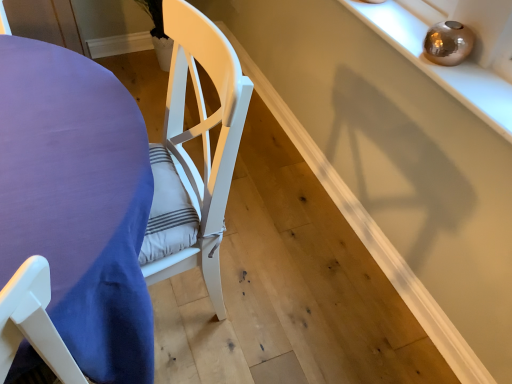
Where is `shiny metallic orb at upper right`? shiny metallic orb at upper right is located at coordinates (441, 66).

Describe the element at coordinates (441, 66) in the screenshot. I see `shiny metallic orb at upper right` at that location.

Measure the distance between point [344,1] and camera.

The distance of point [344,1] from camera is 4.51 feet.

Image resolution: width=512 pixels, height=384 pixels. What do you see at coordinates (78, 202) in the screenshot?
I see `purple fabric table at left` at bounding box center [78, 202].

What are the coordinates of `purple fabric table at left` in the screenshot? It's located at (78, 202).

Measure the distance between point (115, 367) and camera.

They are 39.13 inches apart.

Identify the location of shiny metallic orb at upper right. This screenshot has height=384, width=512. coord(441,66).

Considering the positions of objects purple fabric table at left and shiny metallic orb at upper right in the image provided, who is more to the left, purple fabric table at left or shiny metallic orb at upper right?

purple fabric table at left is more to the left.

Who is more distant, purple fabric table at left or shiny metallic orb at upper right?

shiny metallic orb at upper right is more distant.

Does point (38, 226) come closer to viewer compared to point (399, 41)?

Yes, point (38, 226) is closer to viewer.

From the image's perspective, is purple fabric table at left positioned above or below shiny metallic orb at upper right?

From the image's perspective, purple fabric table at left appears below shiny metallic orb at upper right.

From a real-world perspective, between purple fabric table at left and shiny metallic orb at upper right, who is vertically higher?

In real-world perspective, shiny metallic orb at upper right is above.

Which object is wider, purple fabric table at left or shiny metallic orb at upper right?

purple fabric table at left.

Can you confirm if purple fabric table at left is shorter than shiny metallic orb at upper right?

No, purple fabric table at left is not shorter than shiny metallic orb at upper right.

Considering the sizes of objects purple fabric table at left and shiny metallic orb at upper right in the image provided, who is bigger, purple fabric table at left or shiny metallic orb at upper right?

With larger size is purple fabric table at left.

Is purple fabric table at left inside the boundaries of shiny metallic orb at upper right, or outside?

purple fabric table at left exists outside the volume of shiny metallic orb at upper right.

Is purple fabric table at left beside shiny metallic orb at upper right?

They are not placed beside each other.

Consider the image. Could you tell me if purple fabric table at left is facing shiny metallic orb at upper right?

No, purple fabric table at left is not oriented towards shiny metallic orb at upper right.

How different are the orientations of purple fabric table at left and shiny metallic orb at upper right in degrees?

The facing directions of purple fabric table at left and shiny metallic orb at upper right are 0.504 degrees apart.

Image resolution: width=512 pixels, height=384 pixels. Identify the location of table on the left of shiny metallic orb at upper right. (78, 202).

Looking at this image, does shiny metallic orb at upper right appear on the left side of purple fabric table at left?

Incorrect, shiny metallic orb at upper right is not on the left side of purple fabric table at left.

From the picture: Which object is more forward, shiny metallic orb at upper right or purple fabric table at left?

purple fabric table at left is closer to the camera.

Is point (380, 28) behind point (100, 281)?

Yes, it is behind point (100, 281).

From the image's perspective, would you say shiny metallic orb at upper right is positioned over purple fabric table at left?

Yes, from the image's perspective, shiny metallic orb at upper right is over purple fabric table at left.

From a real-world perspective, which is physically below, shiny metallic orb at upper right or purple fabric table at left?

purple fabric table at left, from a real-world perspective.

Is shiny metallic orb at upper right wider than purple fabric table at left?

No, shiny metallic orb at upper right is not wider than purple fabric table at left.

Based on the photo, is shiny metallic orb at upper right shorter than purple fabric table at left?

Correct, shiny metallic orb at upper right is not as tall as purple fabric table at left.

Can you confirm if shiny metallic orb at upper right is smaller than purple fabric table at left?

Yes, shiny metallic orb at upper right is smaller than purple fabric table at left.

Based on the photo, is shiny metallic orb at upper right not inside purple fabric table at left?

shiny metallic orb at upper right lies outside purple fabric table at left's area.

Can you see shiny metallic orb at upper right touching purple fabric table at left?

They are not placed beside each other.

Is shiny metallic orb at upper right oriented towards purple fabric table at left?

Yes, shiny metallic orb at upper right is turned towards purple fabric table at left.

Where is `shelf located above the purple fabric table at left (from the image's perspective)`? shelf located above the purple fabric table at left (from the image's perspective) is located at coordinates (441, 66).

The height and width of the screenshot is (384, 512). Find the location of `table lying below the shiny metallic orb at upper right (from the image's perspective)`. table lying below the shiny metallic orb at upper right (from the image's perspective) is located at coordinates (78, 202).

Where is `shelf behind the purple fabric table at left`? shelf behind the purple fabric table at left is located at coordinates (441, 66).